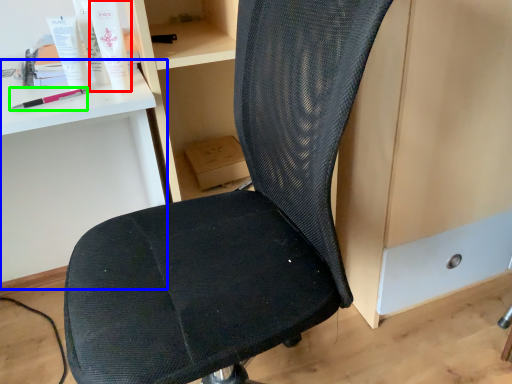
Question: Based on their relative distances, which object is farther from toiletry (highlighted by a red box)? Choose from computer desk (highlighted by a blue box) and equipment (highlighted by a green box).

Choices:
 (A) computer desk
 (B) equipment

Answer: (A)